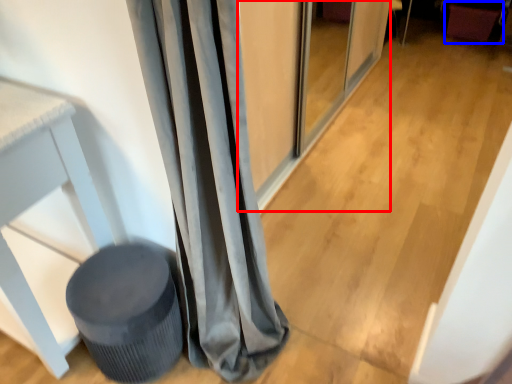
Question: Which object is closer to the camera taking this photo, screen door (highlighted by a red box) or swivel chair (highlighted by a blue box)?

Choices:
 (A) screen door
 (B) swivel chair

Answer: (A)